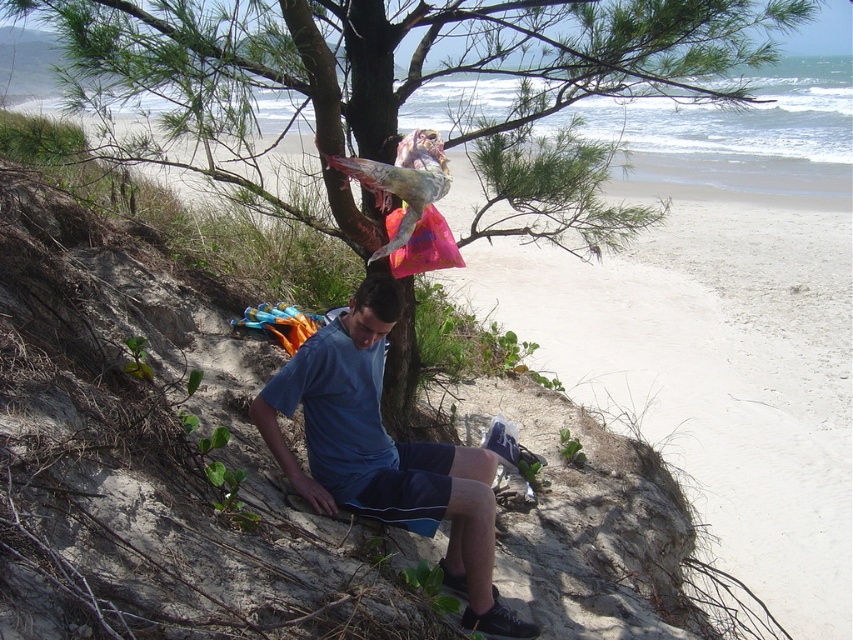
Is green leafy tree at center further to camera compared to blue fabric shorts at center?

No, it is not.

Does green leafy tree at center have a lesser height compared to blue fabric shorts at center?

Incorrect, green leafy tree at center's height does not fall short of blue fabric shorts at center's.

Is point (663, 6) positioned after point (283, 452)?

That is True.

Find the location of a particular element. This screenshot has width=853, height=640. green leafy tree at center is located at coordinates 418,83.